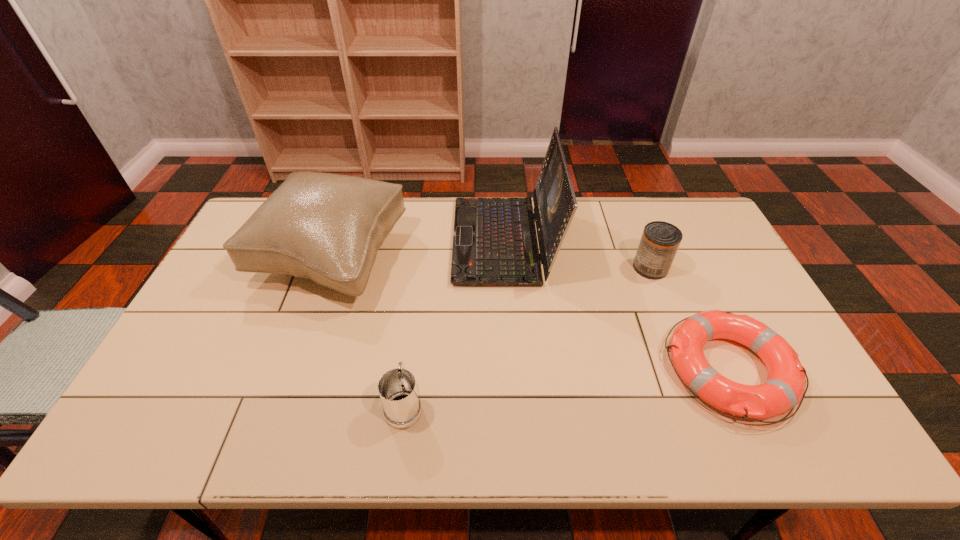
This screenshot has height=540, width=960. I want to click on empty space between the mug and the third shortest object, so click(x=527, y=336).

You are a GUI agent. You are given a task and a screenshot of the screen. Output one action in this format:
    pyautogui.click(x=<x>, y=<y>)
    Task: Click on the free space between the third shortest object and the second object from left to right
    The image size is (960, 540).
    Given the screenshot: What is the action you would take?
    [x=527, y=336]

Find the location of `empty space between the third shortest object and the laptop computer`. empty space between the third shortest object and the laptop computer is located at coordinates (577, 254).

The image size is (960, 540). In order to click on vacant space that's between the third object from left to right and the fourth object from right to left in this screenshot , I will do `click(454, 322)`.

Locate which object is the third closest to the cushion. Please provide its 2D coordinates. Your answer should be formatted as a tuple, i.e. [(x, y)], where the tuple contains the x and y coordinates of a point satisfying the conditions above.

[(784, 388)]

I want to click on object that stands as the third closest to the cushion, so click(x=784, y=388).

I want to click on vacant space that satisfies the following two spatial constraints: 1. on the screen of the life buoy; 2. on the left side of the third object from left to right, so click(512, 369).

This screenshot has height=540, width=960. Find the location of `vacant area that satisfies the following two spatial constraints: 1. on the side of the life buoy with the handle; 2. on the left side of the fourth tallest object`. vacant area that satisfies the following two spatial constraints: 1. on the side of the life buoy with the handle; 2. on the left side of the fourth tallest object is located at coordinates (409, 369).

Find the location of `vacant space that satisfies the following two spatial constraints: 1. on the side of the mug with the handle; 2. on the left side of the third shortest object`. vacant space that satisfies the following two spatial constraints: 1. on the side of the mug with the handle; 2. on the left side of the third shortest object is located at coordinates (422, 267).